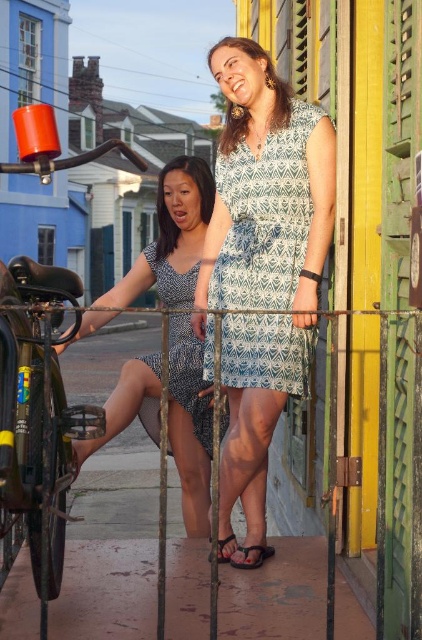
Question: Considering the real-world distances, which object is closest to the brown leather sandal at lower center?

Choices:
 (A) shiny black bicycle at left
 (B) black rubber sandal at lower center
 (C) blue printed dress at center

Answer: (B)

Question: Can you confirm if printed cotton dress at center is thinner than brown leather sandal at lower center?

Choices:
 (A) no
 (B) yes

Answer: (A)

Question: Which point is farther from the camera taking this photo?

Choices:
 (A) (124, 410)
 (B) (32, 435)

Answer: (A)

Question: Does printed cotton dress at center have a greater width compared to shiny black bicycle at left?

Choices:
 (A) yes
 (B) no

Answer: (A)

Question: Considering the relative positions of blue printed dress at center and printed fabric dress at center in the image provided, where is blue printed dress at center located with respect to printed fabric dress at center?

Choices:
 (A) above
 (B) below

Answer: (A)

Question: Which object appears closest to the camera in this image?

Choices:
 (A) black rubber sandal at lower center
 (B) brown leather sandal at lower center
 (C) printed fabric dress at center
 (D) printed cotton dress at center

Answer: (D)